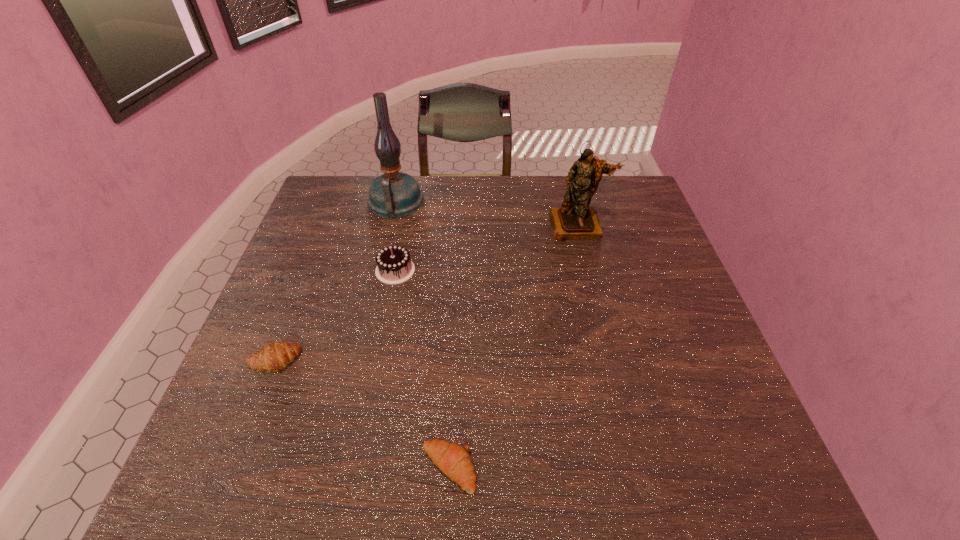
In order to click on free space located on the front-facing side of the fourth shortest object in this screenshot , I will do `click(610, 352)`.

Identify the location of vacant space located 0.050m on the left of the chocolate cake. The width and height of the screenshot is (960, 540). (357, 271).

At what (x,y) coordinates should I click in order to perform the action: click on vacant space located on the right of the fourth tallest object. Please return your answer as a coordinate pair (x, y). Looking at the image, I should click on (391, 361).

Where is `free space located 0.120m on the right of the right crescent roll`? free space located 0.120m on the right of the right crescent roll is located at coordinates (541, 468).

Where is `oil lamp present at the far edge`? oil lamp present at the far edge is located at coordinates (394, 194).

Where is `figurine located in the far edge section of the desktop`? This screenshot has width=960, height=540. figurine located in the far edge section of the desktop is located at coordinates (575, 219).

You are a GUI agent. You are given a task and a screenshot of the screen. Output one action in this format:
    pyautogui.click(x=<x>, y=<y>)
    Task: Click on the object that is at the near edge
    The width and height of the screenshot is (960, 540).
    Given the screenshot: What is the action you would take?
    pyautogui.click(x=453, y=460)

I want to click on object at the left edge, so click(276, 356).

Where is `object located in the right edge section of the desktop`? The height and width of the screenshot is (540, 960). object located in the right edge section of the desktop is located at coordinates (575, 219).

Where is `object that is at the far right corner`? The image size is (960, 540). object that is at the far right corner is located at coordinates (575, 219).